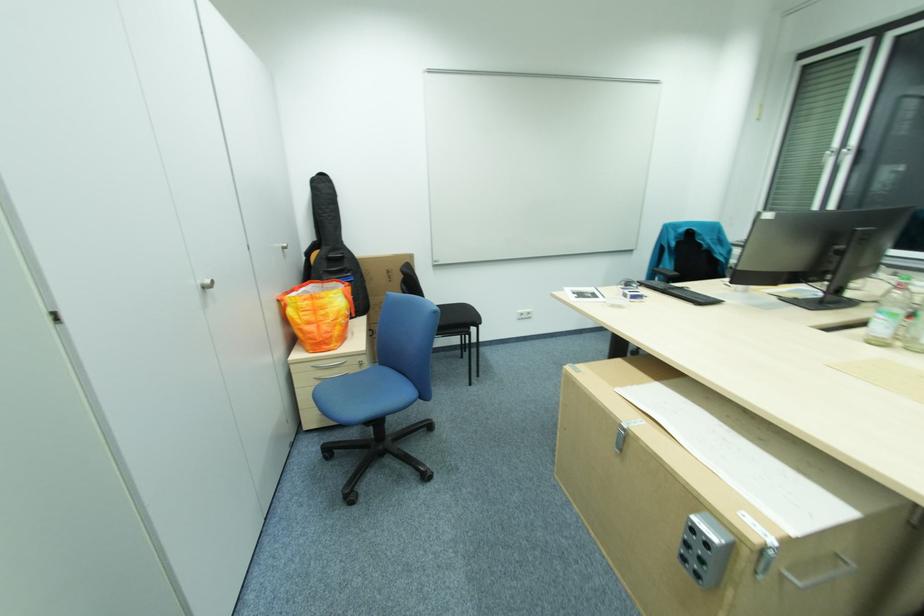
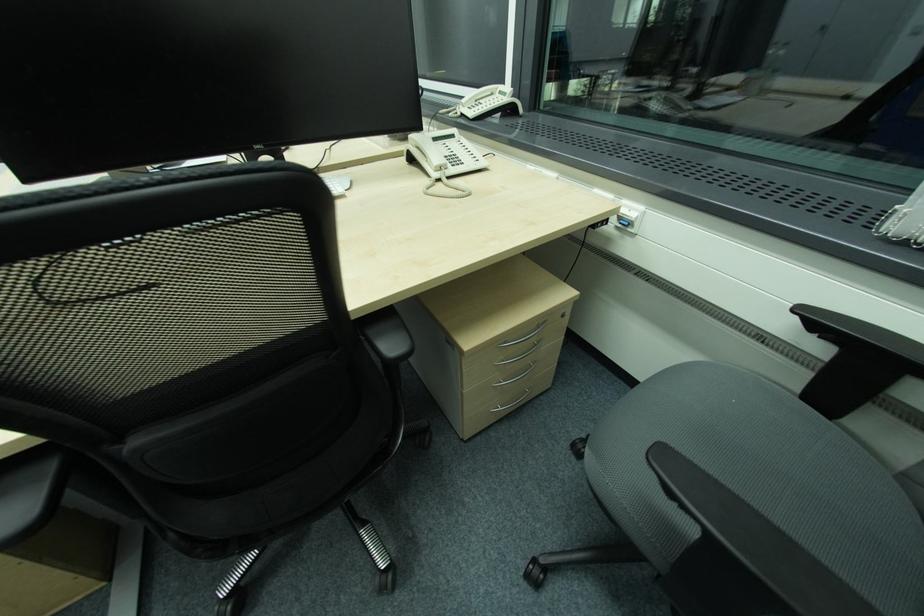
Question: What movement of the cameraman would produce the second image?

Choices:
 (A) Left
 (B) Right
 (C) Forward
 (D) Backward

Answer: (B)